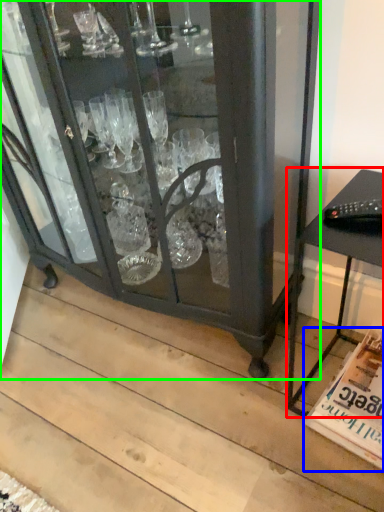
Question: Based on their relative distances, which object is farther from table (highlighted by a red box)? Choose from magazine (highlighted by a blue box) and furniture (highlighted by a green box).

Choices:
 (A) magazine
 (B) furniture

Answer: (B)